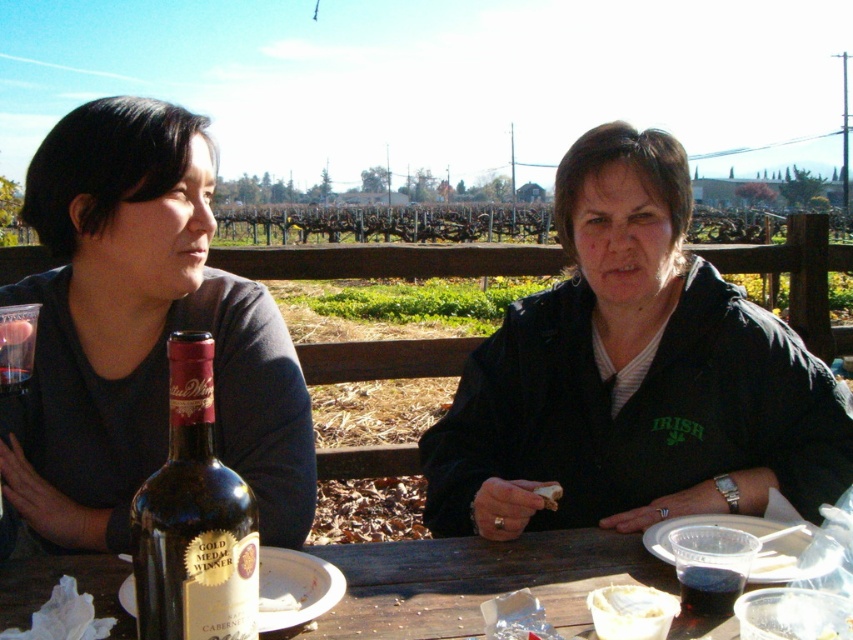
Is matte black shirt at left smaller than dark red liquid at table center?

Actually, matte black shirt at left might be larger than dark red liquid at table center.

Where is `matte black shirt at left`? matte black shirt at left is located at coordinates [x=143, y=332].

Describe the element at coordinates (143, 332) in the screenshot. I see `matte black shirt at left` at that location.

You are a GUI agent. You are given a task and a screenshot of the screen. Output one action in this format:
    pyautogui.click(x=<x>, y=<y>)
    Task: Click on the matte black shirt at left
    The height and width of the screenshot is (640, 853).
    Given the screenshot: What is the action you would take?
    pyautogui.click(x=143, y=332)

Which is more to the right, matte black shirt at left or dark purple liquid at lower right?

From the viewer's perspective, dark purple liquid at lower right appears more on the right side.

Does matte black shirt at left appear over dark purple liquid at lower right?

Yes, matte black shirt at left is above dark purple liquid at lower right.

Is point (225, 321) closer to camera compared to point (677, 556)?

No, (225, 321) is further to viewer.

At what (x,y) coordinates should I click in order to perform the action: click on matte black shirt at left. Please return your answer as a coordinate pair (x, y). Looking at the image, I should click on (143, 332).

In the scene shown: Who is positioned more to the left, wooden table at center or white creamy cheese at center?

Positioned to the left is wooden table at center.

Is wooden table at center thinner than white creamy cheese at center?

No.

Locate an element on the screen. wooden table at center is located at coordinates [479, 580].